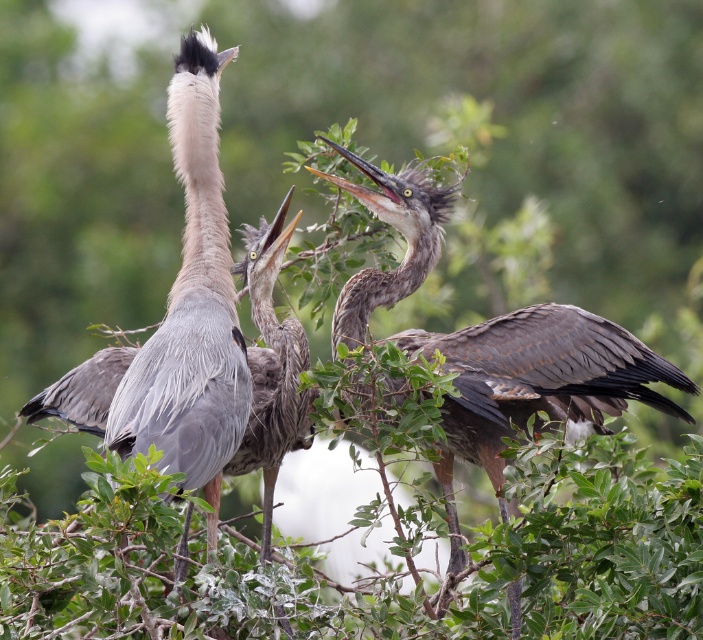
You are standing in front of a tree where three Great Blue Herons are perched. You notice two points marked on the image at coordinates point (591, 326) and point (226, 305). Which of these points is closer to you?

Point (591, 326) is closer to you because it is further to the viewer than point (226, 305).

Looking at this image, you are a birdwatcher observing the three Great Blue Herons in the tree. You notice the gray feathered heron at center and the gray feathered heron at left. Which heron is positioned lower in the tree?

The gray feathered heron at center is located below the gray feathered heron at left, so the gray feathered heron at center is positioned lower in the tree.